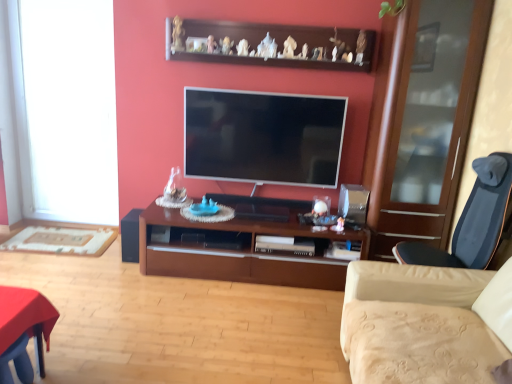
Question: From a real-world perspective, is wooden shelf at upper center over brown wood cabinet at center?

Choices:
 (A) yes
 (B) no

Answer: (A)

Question: Considering the relative sizes of wooden shelf at upper center and brown wood cabinet at center in the image provided, is wooden shelf at upper center smaller than brown wood cabinet at center?

Choices:
 (A) no
 (B) yes

Answer: (B)

Question: Is the position of wooden shelf at upper center less distant than that of brown wood cabinet at center?

Choices:
 (A) yes
 (B) no

Answer: (B)

Question: Would you say wooden shelf at upper center contains brown wood cabinet at center?

Choices:
 (A) yes
 (B) no

Answer: (B)

Question: Is wooden shelf at upper center taller than brown wood cabinet at center?

Choices:
 (A) yes
 (B) no

Answer: (B)

Question: Is wooden shelf at upper center facing towards brown wood cabinet at center?

Choices:
 (A) yes
 (B) no

Answer: (B)

Question: Is transparent glass cabinet at right oriented away from white glass window at left?

Choices:
 (A) yes
 (B) no

Answer: (B)

Question: Is transparent glass cabinet at right bigger than white glass window at left?

Choices:
 (A) yes
 (B) no

Answer: (A)

Question: From the image's perspective, is transparent glass cabinet at right under white glass window at left?

Choices:
 (A) yes
 (B) no

Answer: (A)

Question: Is transparent glass cabinet at right to the left of white glass window at left from the viewer's perspective?

Choices:
 (A) yes
 (B) no

Answer: (B)

Question: Would you say transparent glass cabinet at right contains white glass window at left?

Choices:
 (A) no
 (B) yes

Answer: (A)

Question: Considering the relative sizes of transparent glass cabinet at right and white glass window at left in the image provided, is transparent glass cabinet at right taller than white glass window at left?

Choices:
 (A) yes
 (B) no

Answer: (A)

Question: Does wooden shelf at upper center appear on the left side of black matte speaker at lower left?

Choices:
 (A) yes
 (B) no

Answer: (B)